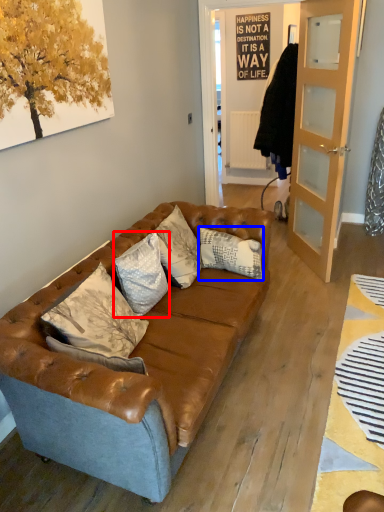
Question: Which point is closer to the camera, pillow (highlighted by a red box) or pillow (highlighted by a blue box)?

Choices:
 (A) pillow
 (B) pillow

Answer: (A)